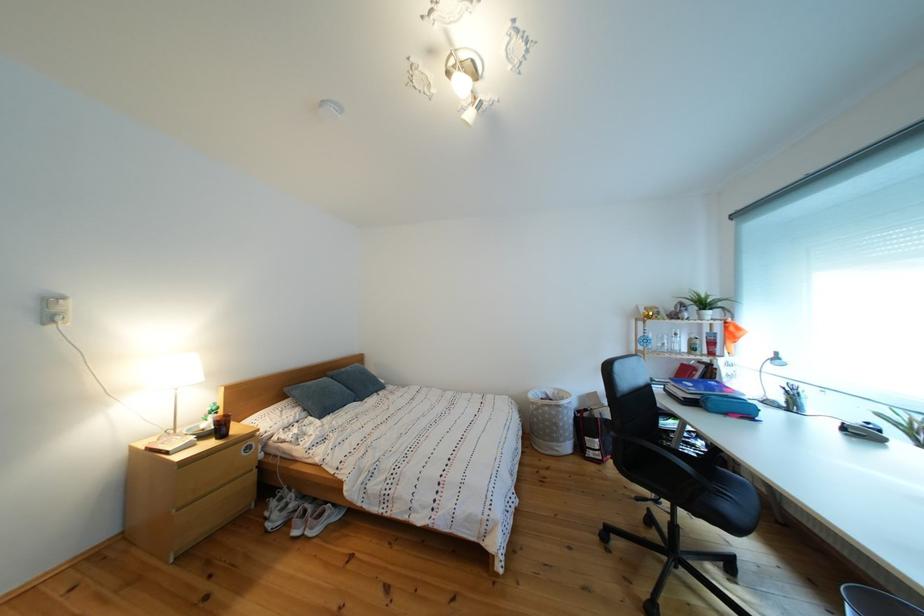
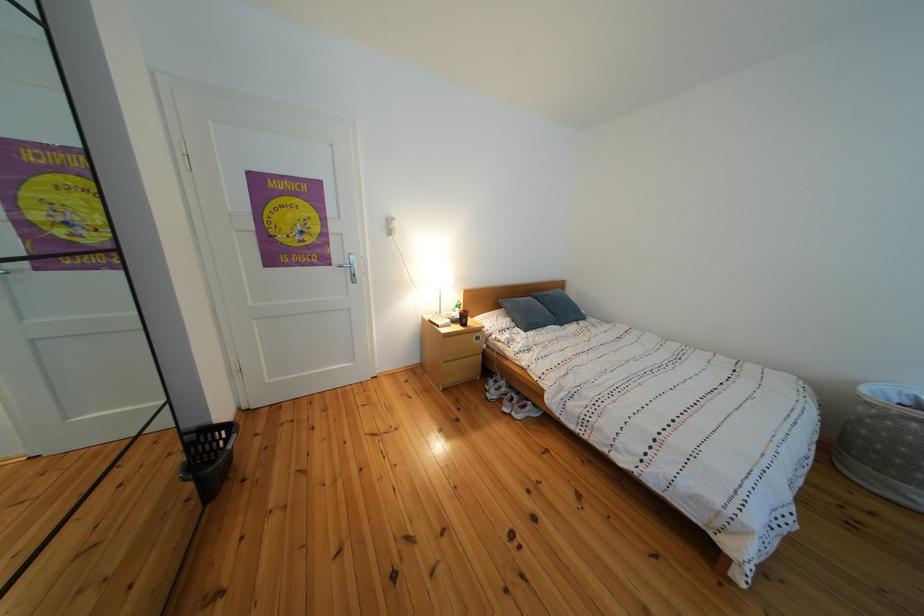
Where in the second image is the point corresponding to point (310, 416) from the first image?

(519, 325)